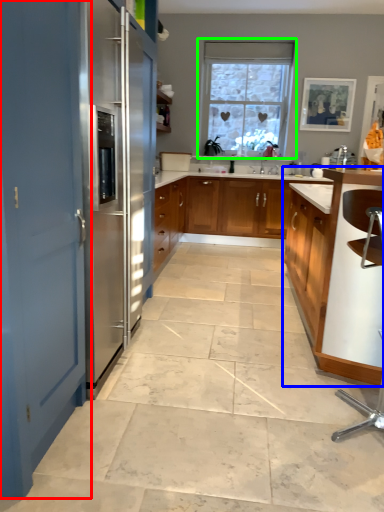
Question: Estimate the real-world distances between objects in this image. Which object is farther from door (highlighted by a red box), cabinetry (highlighted by a blue box) or window (highlighted by a green box)?

Choices:
 (A) cabinetry
 (B) window

Answer: (B)